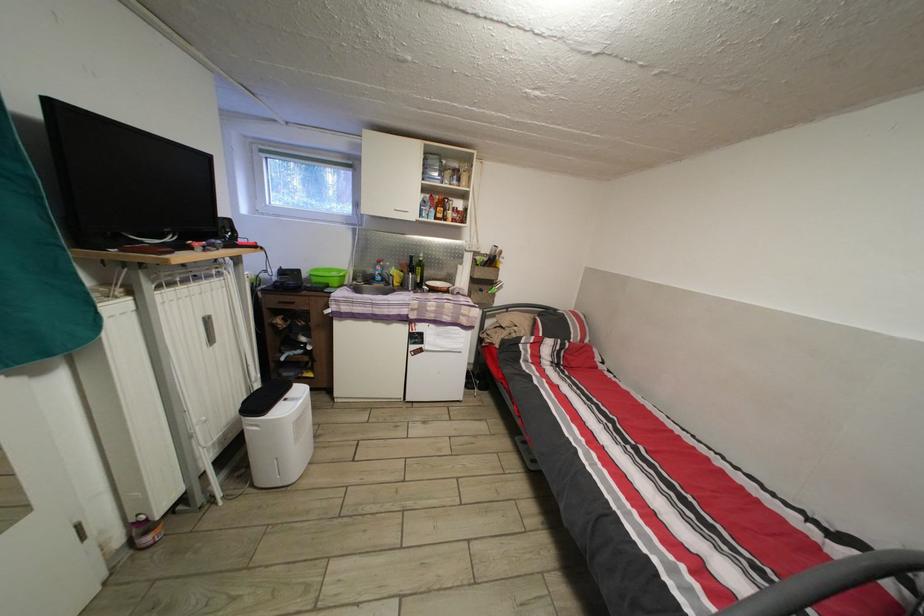
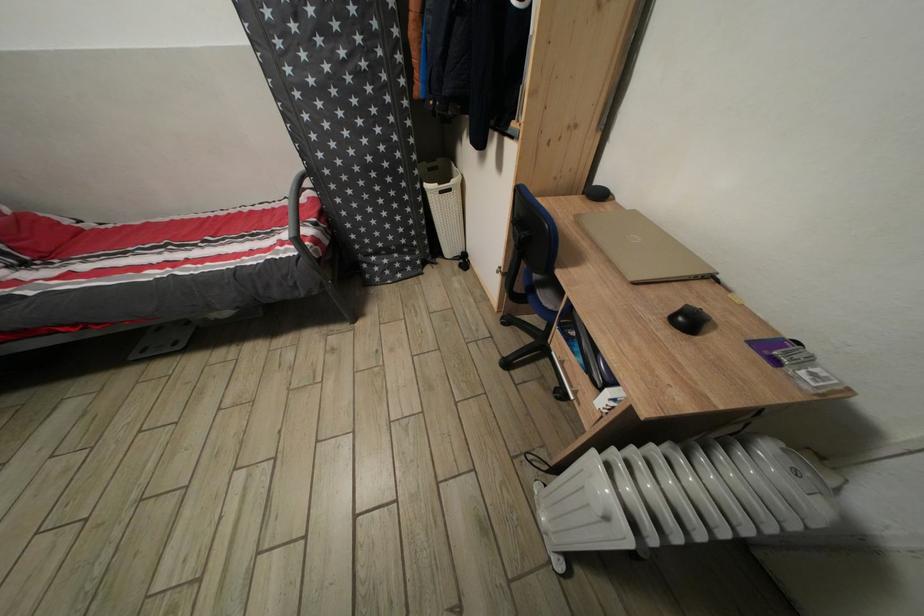
Where in the second image is the point corresponding to the point at 800,525 from the first image?

(294, 209)